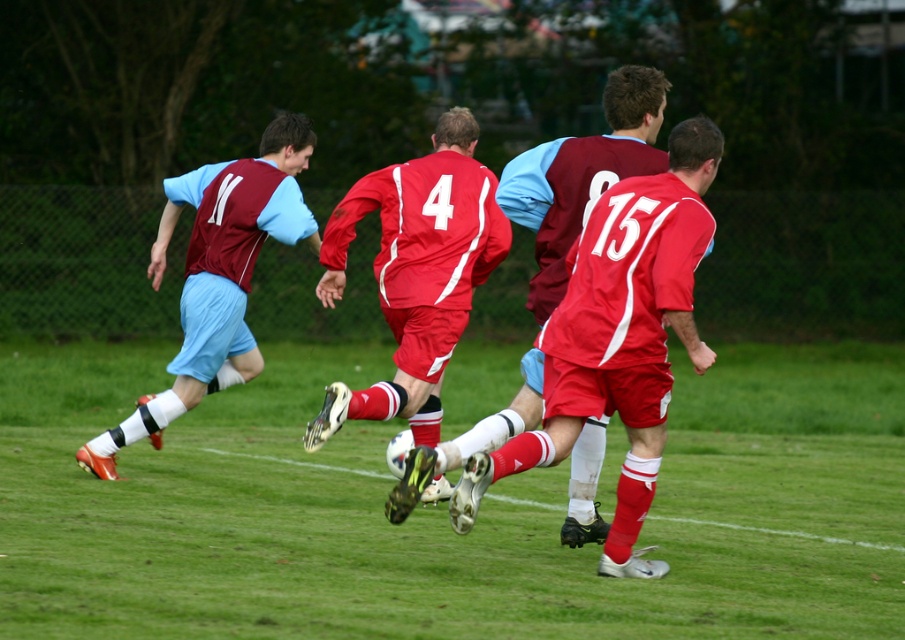
The image size is (905, 640). Describe the element at coordinates (415, 273) in the screenshot. I see `matte red soccer ball at center` at that location.

Is point (455, 136) in front of point (155, 272)?

Yes, it is.

The width and height of the screenshot is (905, 640). In order to click on matte red soccer ball at center in this screenshot , I will do `click(415, 273)`.

Who is higher up, green grass at center or matte red soccer ball at center?

matte red soccer ball at center is higher up.

Is point (472, 577) less distant than point (496, 227)?

Yes, point (472, 577) is in front of point (496, 227).

I want to click on green grass at center, so click(x=445, y=509).

Which of these two, green grass at center or matte maroon jersey at left, stands taller?

With more height is matte maroon jersey at left.

Between point (797, 348) and point (230, 314), which one is positioned in front?

Positioned in front is point (230, 314).

Is point (510, 483) positioned behind point (199, 396)?

That is True.

The width and height of the screenshot is (905, 640). Identify the location of green grass at center. point(445,509).